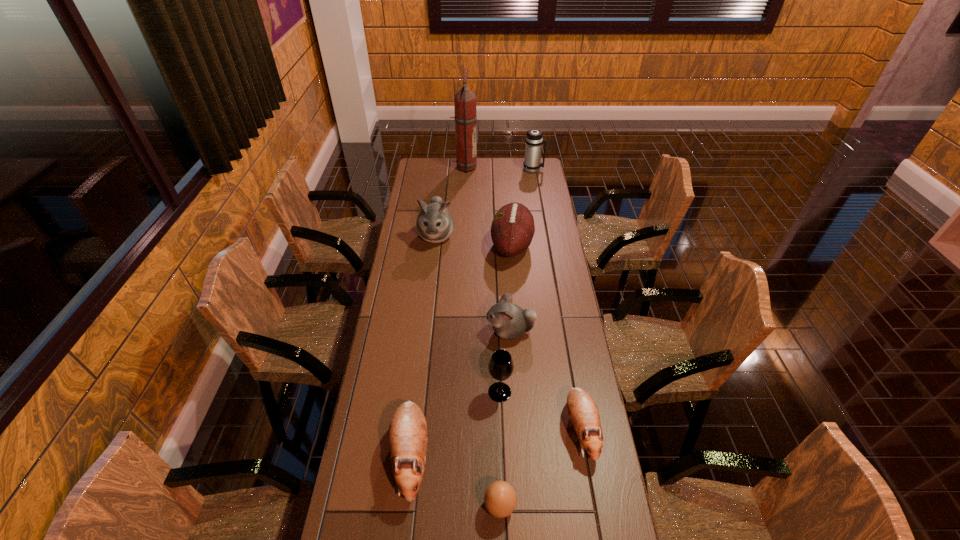
Where is `the tallest object`? the tallest object is located at coordinates (465, 117).

I want to click on fire extinguisher, so click(465, 117).

The image size is (960, 540). I want to click on thermos bottle, so click(534, 139).

I want to click on the farther white hamster, so click(x=435, y=224).

Where is `the farthest hamster`? the farthest hamster is located at coordinates (435, 224).

This screenshot has width=960, height=540. Identify the location of football (American). (512, 230).

Identify the location of wineglass. (501, 366).

The height and width of the screenshot is (540, 960). What are the coordinates of `the fifth farthest object` in the screenshot? It's located at (509, 321).

This screenshot has width=960, height=540. Find the location of `the third hamster from left to right`. the third hamster from left to right is located at coordinates (509, 321).

Find the location of a particular element. The width and height of the screenshot is (960, 540). the bigger brown hamster is located at coordinates 407,435.